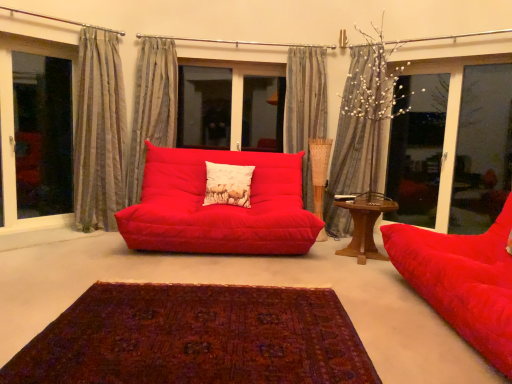
Question: Which direction should I rotate to look at matte red studio couch at center, positioned as the second studio couch in front-to-back order, — up or down?

Choices:
 (A) up
 (B) down

Answer: (A)

Question: Is transparent glass window at left, marked as the first window in a left-to-right arrangement, behind striped fabric curtain at left, the 1th curtain in the left-to-right sequence?

Choices:
 (A) no
 (B) yes

Answer: (B)

Question: Is transparent glass window at left, the 2th window viewed from the right, facing away from striped fabric curtain at left, placed as the fourth curtain when sorted from right to left?

Choices:
 (A) yes
 (B) no

Answer: (B)

Question: Is transparent glass window at left, marked as the first window in a left-to-right arrangement, facing towards striped fabric curtain at left, placed as the fourth curtain when sorted from right to left?

Choices:
 (A) yes
 (B) no

Answer: (A)

Question: From a real-world perspective, is transparent glass window at left, marked as the first window in a left-to-right arrangement, physically below striped fabric curtain at left, the 1th curtain in the left-to-right sequence?

Choices:
 (A) yes
 (B) no

Answer: (A)

Question: Does transparent glass window at left, marked as the first window in a left-to-right arrangement, appear on the left side of striped fabric curtain at left, the 1th curtain in the left-to-right sequence?

Choices:
 (A) yes
 (B) no

Answer: (A)

Question: Can striped fabric curtain at left, the 1th curtain in the left-to-right sequence, be found inside transparent glass window at left, marked as the first window in a left-to-right arrangement?

Choices:
 (A) no
 (B) yes

Answer: (A)

Question: Is there a large distance between beige textured pillow at center and transparent glass window at right, the 2th window when ordered from left to right?

Choices:
 (A) no
 (B) yes

Answer: (B)

Question: Does beige textured pillow at center have a larger size compared to transparent glass window at right, positioned as the 1th window in right-to-left order?

Choices:
 (A) yes
 (B) no

Answer: (B)

Question: Is beige textured pillow at center taller than transparent glass window at right, positioned as the 1th window in right-to-left order?

Choices:
 (A) no
 (B) yes

Answer: (A)

Question: From the image's perspective, is beige textured pillow at center below transparent glass window at right, the 2th window when ordered from left to right?

Choices:
 (A) yes
 (B) no

Answer: (A)

Question: Is beige textured pillow at center at the right side of transparent glass window at right, positioned as the 1th window in right-to-left order?

Choices:
 (A) yes
 (B) no

Answer: (B)

Question: Can you confirm if beige textured pillow at center is smaller than transparent glass window at right, positioned as the 1th window in right-to-left order?

Choices:
 (A) no
 (B) yes

Answer: (B)

Question: Does gray striped curtain at upper center, arranged as the 3th curtain when viewed from the left, have a larger size compared to wooden table at right?

Choices:
 (A) no
 (B) yes

Answer: (B)